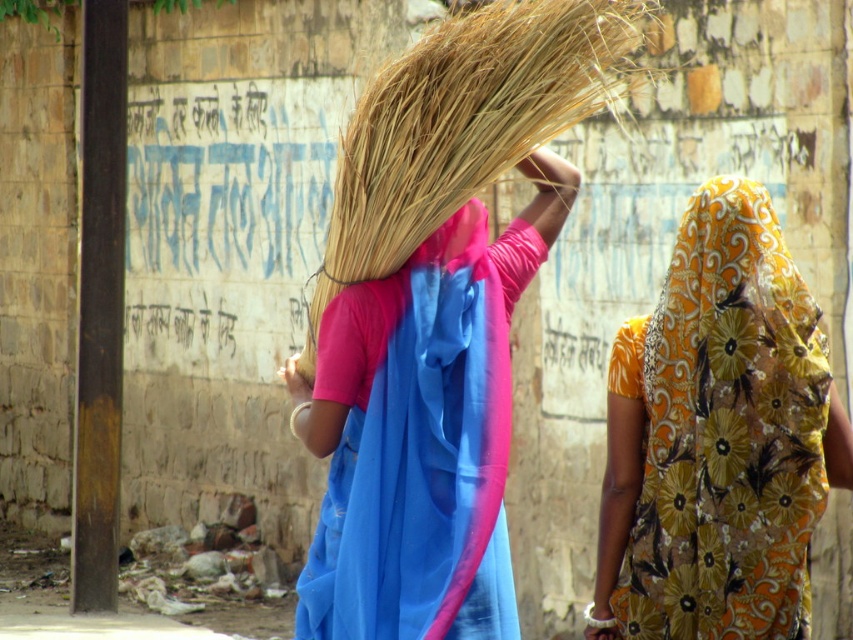
You are a photographer standing at the camera position. You want to capture a closeup shot of the blue silk sari at center. Based on the distance provided, will you need to use a zoom lens to focus on the sari?

The blue silk sari at center and camera are 8.53 meters apart. To capture a closeup shot from that distance, you would need to use a zoom lens to focus on the sari.

You are standing in front of the brick wall and want to reach the floral yellow fabric at upper right. The camera is at your eye level. Can you estimate how far you need to walk to get there?

The floral yellow fabric at upper right is 8.51 meters from the camera, so you need to walk approximately 8.51 meters to reach it.

You are an artist trying to sketch the scene. You need to decide which of the two points, point [459,308] or point [367,212], should be drawn first to establish depth. Based on their positions, which point is closer to you?

Point [459,308] is closer to the viewer than point [367,212], so you should draw it first to establish depth.